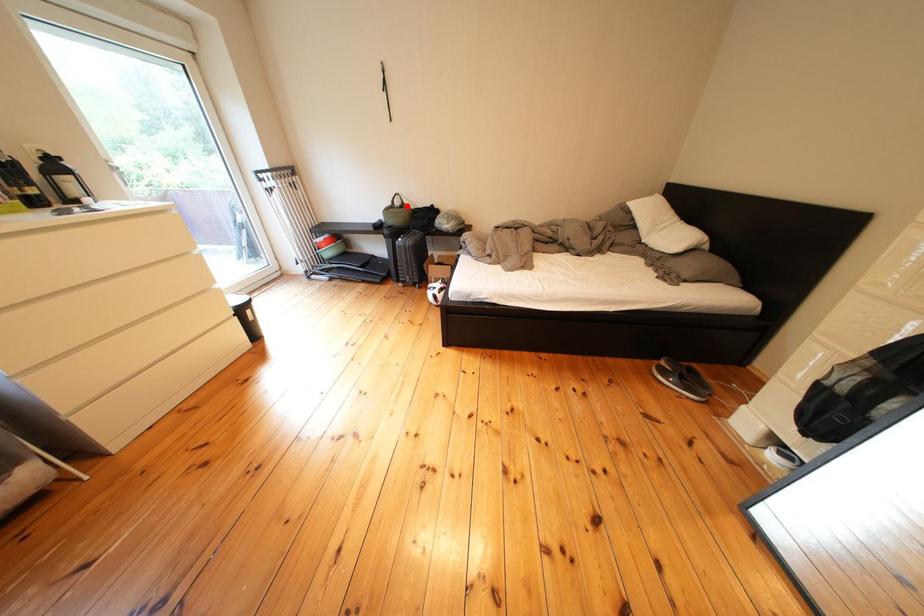
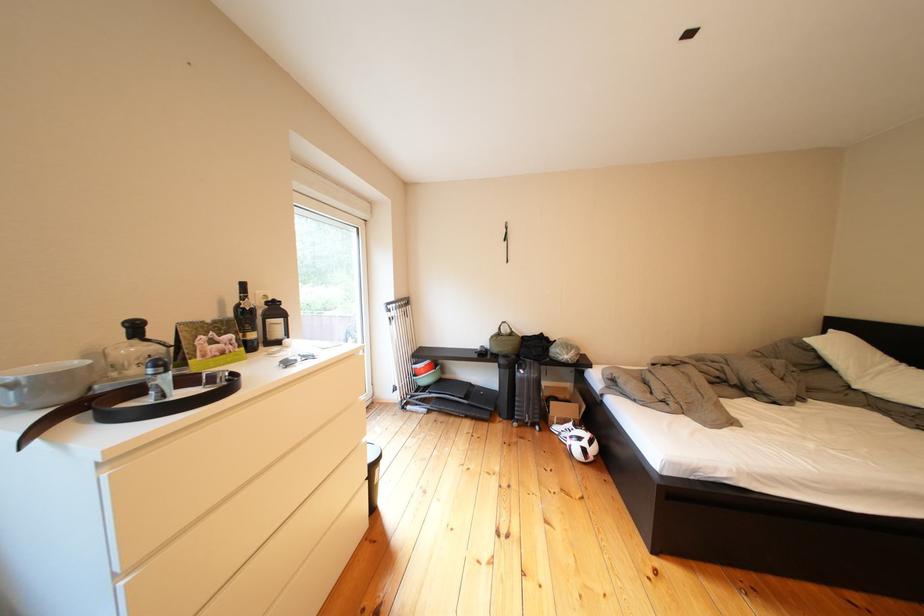
Where in the second image is the point corresponding to the highlighted location from the first image?

(514, 334)